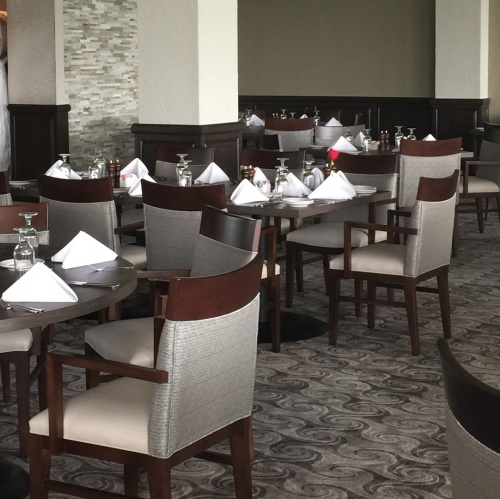
Image resolution: width=500 pixels, height=499 pixels. Find the location of `pepper grinders`. pepper grinders is located at coordinates (110, 168), (119, 164), (243, 172), (254, 171), (326, 171), (330, 169), (382, 134), (387, 142), (273, 113), (277, 114).